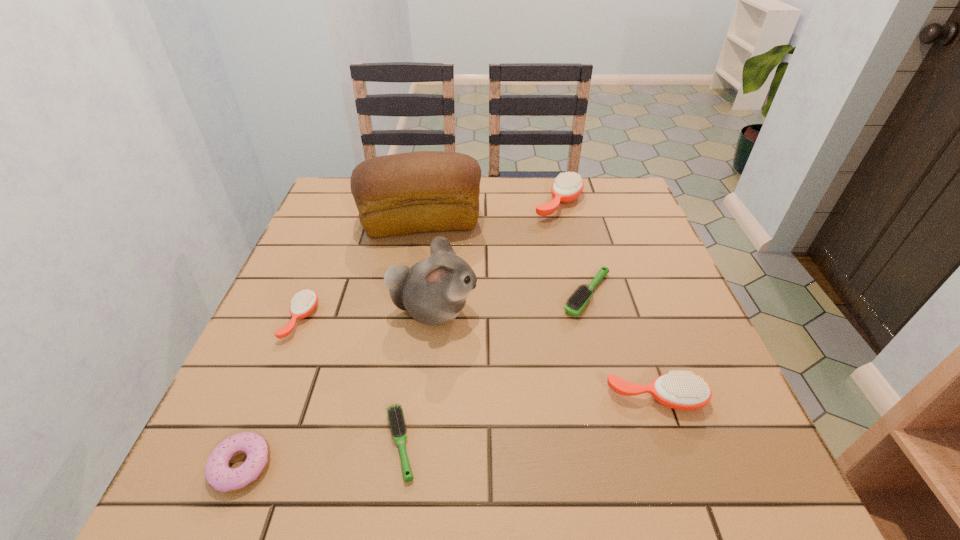
Where is `free spot between the second tallest object and the smaller light hairbrush`? Image resolution: width=960 pixels, height=540 pixels. free spot between the second tallest object and the smaller light hairbrush is located at coordinates (417, 377).

I want to click on free space between the shortest object and the farthest hairbrush, so click(480, 323).

Find the location of `free space between the pink doughnut and the tallest object`. free space between the pink doughnut and the tallest object is located at coordinates (331, 343).

This screenshot has width=960, height=540. I want to click on vacant area that lies between the doughnut and the leftmost hairbrush, so click(271, 392).

At what (x,y) coordinates should I click in order to perform the action: click on free space between the seventh shortest object and the bigger light hairbrush. Please return your answer as a coordinate pair (x, y). The image size is (960, 540). Looking at the image, I should click on (511, 302).

Find the location of a particular element. unoccupied area between the fourth shortest hairbrush and the tallest hairbrush is located at coordinates (608, 301).

This screenshot has width=960, height=540. I want to click on blank region between the farthest hairbrush and the second smallest orange hairbrush, so click(608, 301).

Locate an element on the screen. This screenshot has width=960, height=540. object that ranks as the second closest to the farthest orange hairbrush is located at coordinates (575, 304).

Select which object is the second closest to the smaller light hairbrush. Please provide its 2D coordinates. Your answer should be formatted as a tuple, i.e. [(x, y)], where the tuple contains the x and y coordinates of a point satisfying the conditions above.

[(218, 474)]

Point out which hairbrush is positioned as the nearest to the bigger light hairbrush. Please provide its 2D coordinates. Your answer should be formatted as a tuple, i.e. [(x, y)], where the tuple contains the x and y coordinates of a point satisfying the conditions above.

[(679, 390)]